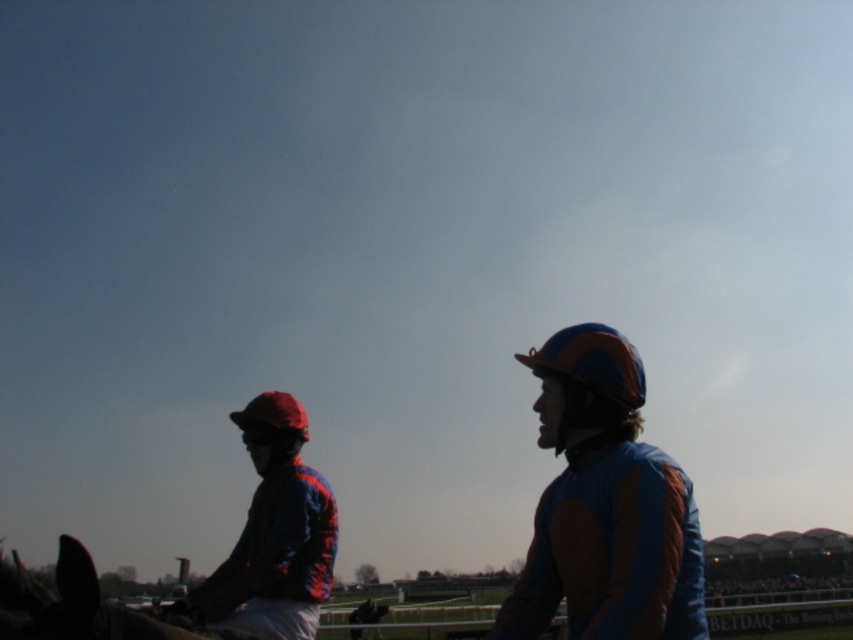
Which of these two, shiny blue and orange jockey suit at center or blue matte helmet at center, stands shorter?

shiny blue and orange jockey suit at center is shorter.

Who is more distant from viewer, (616,448) or (614,541)?

The point (616,448) is more distant.

You are a GUI agent. You are given a task and a screenshot of the screen. Output one action in this format:
    pyautogui.click(x=<x>, y=<y>)
    Task: Click on the shiny blue and orange jockey suit at center
    
    Given the screenshot: What is the action you would take?
    pyautogui.click(x=605, y=506)

Based on the photo, does blue matte helmet at center appear over shiny blue fabric jockey at left?

Yes.

Between blue matte helmet at center and shiny blue fabric jockey at left, which one appears on the left side from the viewer's perspective?

shiny blue fabric jockey at left is more to the left.

Does point (611, 483) come behind point (294, 429)?

No, (611, 483) is in front of (294, 429).

Find the location of a particular element. blue matte helmet at center is located at coordinates (605, 506).

Does shiny blue and orange jockey suit at center appear under shiny blue fabric jockey at left?

Incorrect, shiny blue and orange jockey suit at center is not positioned below shiny blue fabric jockey at left.

In the scene shown: Who is taller, shiny blue and orange jockey suit at center or shiny blue fabric jockey at left?

Standing taller between the two is shiny blue and orange jockey suit at center.

Is point (635, 497) positioned behind point (268, 579)?

No, (635, 497) is closer to viewer.

Where is `shiny blue and orange jockey suit at center`? This screenshot has width=853, height=640. shiny blue and orange jockey suit at center is located at coordinates click(605, 506).